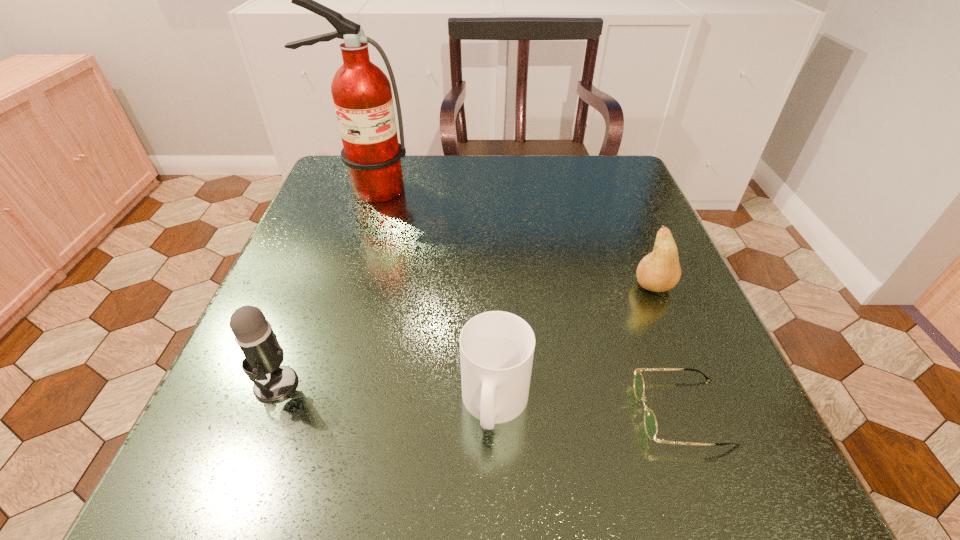
The height and width of the screenshot is (540, 960). Find the location of `object that is at the far left corner`. object that is at the far left corner is located at coordinates (362, 95).

You are a GUI agent. You are given a task and a screenshot of the screen. Output one action in this format:
    pyautogui.click(x=<x>, y=<y>)
    Task: Click on the object situated at the near right corner
    Image resolution: width=960 pixels, height=540 pixels.
    Given the screenshot: What is the action you would take?
    pyautogui.click(x=650, y=422)

The image size is (960, 540). I want to click on vacant area at the far edge, so click(469, 155).

Where is `free space at the near edge`? The image size is (960, 540). free space at the near edge is located at coordinates 598,505.

This screenshot has height=540, width=960. In the image, there is a desktop. What are the coordinates of `vacant space at the left edge` in the screenshot? It's located at (237, 372).

Image resolution: width=960 pixels, height=540 pixels. Find the location of `blank space at the right edge of the desktop`. blank space at the right edge of the desktop is located at coordinates (692, 424).

You are a GUI agent. You are given a task and a screenshot of the screen. Output one action in this format:
    pyautogui.click(x=<x>, y=<y>)
    Task: Click on the free space at the far left corner of the desktop
    This screenshot has width=960, height=540.
    Given the screenshot: What is the action you would take?
    pyautogui.click(x=331, y=205)

Where is `vacant space at the far right corner of the desktop`? This screenshot has width=960, height=540. vacant space at the far right corner of the desktop is located at coordinates (645, 201).

At what (x,y) coordinates should I click in order to perform the action: click on vacant space at the near right corner of the desktop. Please return your answer as a coordinate pair (x, y). The height and width of the screenshot is (540, 960). Looking at the image, I should click on (777, 495).

This screenshot has width=960, height=540. In order to click on empty space that is in between the farthest object and the microphone in this screenshot , I will do `click(322, 286)`.